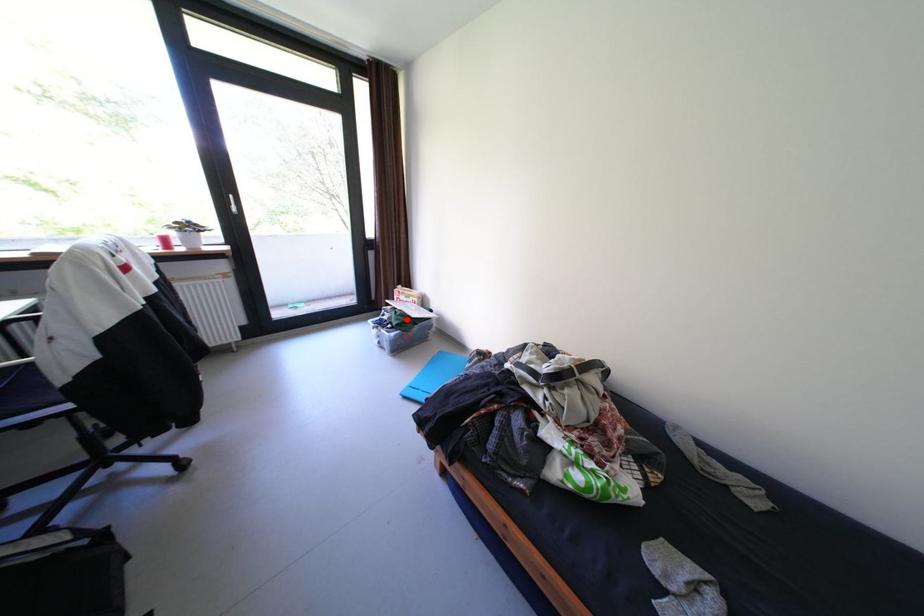
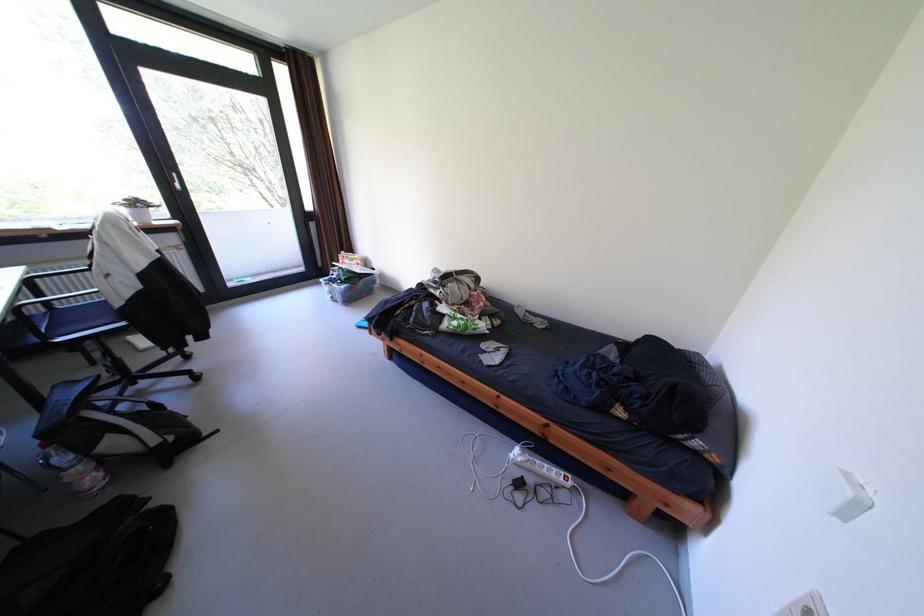
Question: I am providing you with two images of the same scene from different viewpoints. Given a red point in image1, look at the same physical point in image2. Is it:

Choices:
 (A) Closer to the viewpoint
 (B) Farther from the viewpoint

Answer: (A)